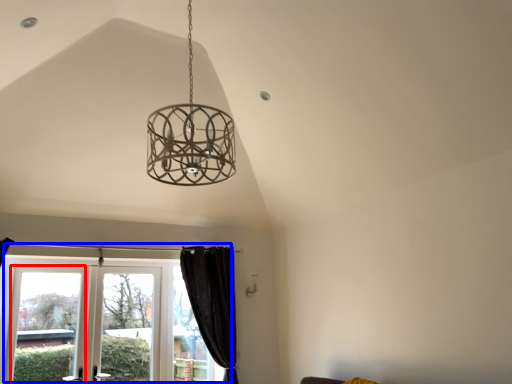
Question: Among these objects, which one is farthest to the camera, window (highlighted by a red box) or window (highlighted by a blue box)?

Choices:
 (A) window
 (B) window

Answer: (A)